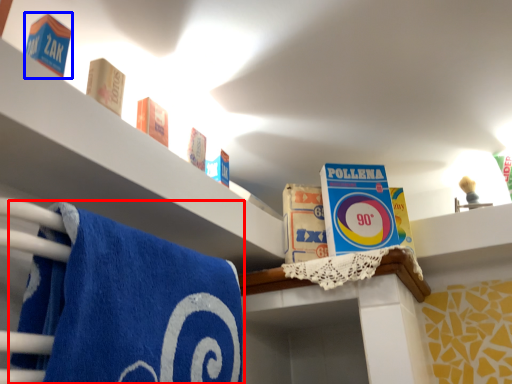
Question: Which object is closer to the camera taking this photo, towel (highlighted by a red box) or product (highlighted by a blue box)?

Choices:
 (A) towel
 (B) product

Answer: (A)